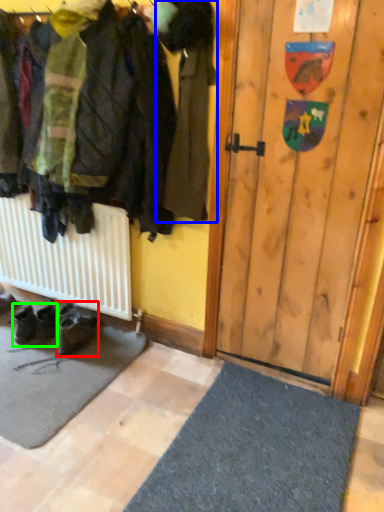
Question: Which is nearer to the footwear (highlighted by a red box)? jacket (highlighted by a blue box) or footwear (highlighted by a green box).

Choices:
 (A) jacket
 (B) footwear

Answer: (B)